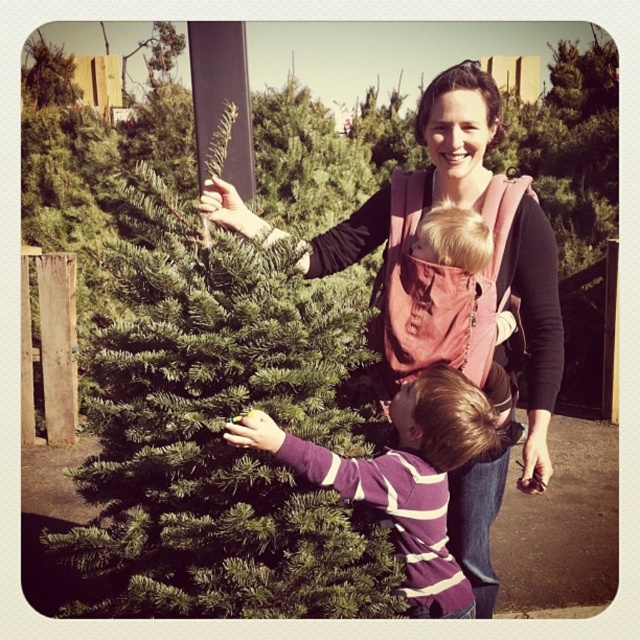
Question: Is pink fabric carrier at center to the right of purple striped sweater at center from the viewer's perspective?

Choices:
 (A) yes
 (B) no

Answer: (A)

Question: Can you confirm if pink fabric carrier at center is positioned to the right of purple striped sweater at center?

Choices:
 (A) yes
 (B) no

Answer: (A)

Question: Which point is farther from the camera taking this photo?

Choices:
 (A) (385, 474)
 (B) (234, 115)

Answer: (B)

Question: Which point is closer to the camera?

Choices:
 (A) (403, 500)
 (B) (100, 557)

Answer: (A)

Question: Which point is farther to the camera?

Choices:
 (A) green matte christmas tree at left
 (B) pink fabric carrier at center

Answer: (B)

Question: Is green matte christmas tree at left below purple striped sweater at center?

Choices:
 (A) yes
 (B) no

Answer: (B)